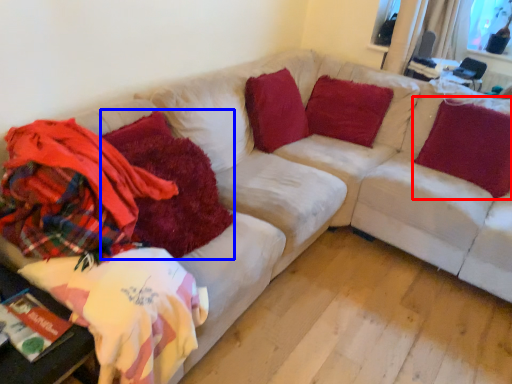
Question: Among these objects, which one is nearest to the camera, pillow (highlighted by a red box) or blanket (highlighted by a blue box)?

Choices:
 (A) pillow
 (B) blanket

Answer: (B)